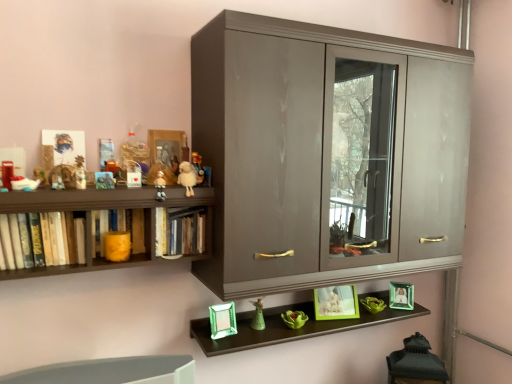
Find the location of a particular element. matte plastic toy at upper left, the 6th toy when ordered from right to left is located at coordinates (112, 168).

The image size is (512, 384). Describe the element at coordinates (112, 168) in the screenshot. I see `matte plastic toy at upper left, the second toy in the left-to-right sequence` at that location.

Looking at this image, in order to face matte plastic toy at upper center, which is the 4th toy from right to left, should I rotate leftwards or rightwards?

Rotate left and turn 12.346 degrees.

This screenshot has height=384, width=512. What do you see at coordinates (198, 167) in the screenshot?
I see `matte plastic toy at upper center, marked as the second toy in a back-to-front arrangement` at bounding box center [198, 167].

Image resolution: width=512 pixels, height=384 pixels. Identify the location of green glass photo frame at lower right, positioned as the first picture frame in right-to-left order. (401, 295).

Describe the element at coordinates (187, 177) in the screenshot. I see `fluffy white lamb at upper center, marked as the 3th toy in a right-to-left arrangement` at that location.

This screenshot has width=512, height=384. Describe the element at coordinates (166, 146) in the screenshot. I see `matte wooden picture frame at upper center, the 1th picture frame from the top` at that location.

Identify the location of matte plastic toy at upper left, arranged as the fifth toy when viewed from the front. The width and height of the screenshot is (512, 384). [112, 168].

Is matte wooden picture frame at upper center, the 1th picture frame from the top, at the right side of fluffy white lamb at upper center, which appears as the fifth toy when ordered from the bottom?

No, matte wooden picture frame at upper center, the 1th picture frame from the top, is not to the right of fluffy white lamb at upper center, which appears as the fifth toy when ordered from the bottom.

Measure the distance between matte wooden picture frame at upper center, the 3th picture frame ordered from the bottom, and fluffy white lamb at upper center, the fourth toy when ordered from front to back.

matte wooden picture frame at upper center, the 3th picture frame ordered from the bottom, and fluffy white lamb at upper center, the fourth toy when ordered from front to back, are 7.18 inches apart.

Is matte wooden picture frame at upper center, the first picture frame when ordered from left to right, further to the viewer compared to fluffy white lamb at upper center, which appears as the fifth toy when ordered from the bottom?

Result: Yes, matte wooden picture frame at upper center, the first picture frame when ordered from left to right, is further from the viewer.

Is matte wooden picture frame at upper center, the 1th picture frame from the top, next to fluffy white lamb at upper center, marked as the 3th toy in a right-to-left arrangement?

matte wooden picture frame at upper center, the 1th picture frame from the top, is not next to fluffy white lamb at upper center, marked as the 3th toy in a right-to-left arrangement, and they're not touching.

Is matte plastic toy at upper center, marked as the second toy in a back-to-front arrangement, not within matte plastic toy at upper left, arranged as the fifth toy when viewed from the front?

matte plastic toy at upper center, marked as the second toy in a back-to-front arrangement, is positioned outside matte plastic toy at upper left, arranged as the fifth toy when viewed from the front.

Is matte plastic toy at upper center, marked as the first toy in a top-to-bottom arrangement, facing towards matte plastic toy at upper left, the 6th toy when ordered from bottom to top?

No, matte plastic toy at upper center, marked as the first toy in a top-to-bottom arrangement, does not turn towards matte plastic toy at upper left, the 6th toy when ordered from bottom to top.

How distant is matte plastic toy at upper center, positioned as the 6th toy in left-to-right order, from matte plastic toy at upper left, the 6th toy when ordered from right to left?

The distance of matte plastic toy at upper center, positioned as the 6th toy in left-to-right order, from matte plastic toy at upper left, the 6th toy when ordered from right to left, is 26.35 centimeters.

Looking at this image, is matte plastic toy at upper center, placed as the 7th toy when sorted from bottom to top, smaller than matte plastic toy at upper left, arranged as the fifth toy when viewed from the front?

No.

Considering the points (202, 174) and (119, 254), which point is behind, point (202, 174) or point (119, 254)?

Positioned behind is point (202, 174).

Considering the sizes of matte plastic toy at upper center, marked as the first toy in a top-to-bottom arrangement, and orange matte candle at left, arranged as the second book when viewed from the left, in the image, is matte plastic toy at upper center, marked as the first toy in a top-to-bottom arrangement, taller or shorter than orange matte candle at left, arranged as the second book when viewed from the left,?

matte plastic toy at upper center, marked as the first toy in a top-to-bottom arrangement, is shorter than orange matte candle at left, arranged as the second book when viewed from the left.

Could you tell me if matte plastic toy at upper center, marked as the second toy in a back-to-front arrangement, is facing orange matte candle at left, arranged as the second book when viewed from the left?

No, matte plastic toy at upper center, marked as the second toy in a back-to-front arrangement, is not turned towards orange matte candle at left, arranged as the second book when viewed from the left.

Is matte plastic toy at upper center, positioned as the 6th toy in left-to-right order, thinner than orange matte candle at left, arranged as the second book when viewed from the left?

Yes.

From a real-world perspective, is green matte figurine at center, the first toy positioned from the bottom, located beneath matte plastic toy at upper left, the 6th toy when ordered from bottom to top?

Yes.

Is matte plastic toy at upper left, which is counted as the 2th toy, starting from the top, a part of green matte figurine at center, positioned as the 1th toy in right-to-left order?

No, matte plastic toy at upper left, which is counted as the 2th toy, starting from the top, is not inside green matte figurine at center, positioned as the 1th toy in right-to-left order.

Is green matte figurine at center, which appears as the 7th toy when viewed from the top, with matte plastic toy at upper left, acting as the 3th toy starting from the back?

No, green matte figurine at center, which appears as the 7th toy when viewed from the top, is not making contact with matte plastic toy at upper left, acting as the 3th toy starting from the back.

Can you confirm if green matte figurine at center, marked as the 7th toy in a left-to-right arrangement, is thinner than matte plastic toy at upper left, which is counted as the 2th toy, starting from the top?

No.

Is fluffy white lamb at upper center, marked as the third toy in a top-to-bottom arrangement, at the left side of matte brown teddy bear at upper left, acting as the 1th toy starting from the left?

Incorrect, fluffy white lamb at upper center, marked as the third toy in a top-to-bottom arrangement, is not on the left side of matte brown teddy bear at upper left, acting as the 1th toy starting from the left.

Which of these two, fluffy white lamb at upper center, marked as the third toy in a top-to-bottom arrangement, or matte brown teddy bear at upper left, which appears as the first toy when viewed from the front, stands taller?

fluffy white lamb at upper center, marked as the third toy in a top-to-bottom arrangement, is taller.

You are a GUI agent. You are given a task and a screenshot of the screen. Output one action in this format:
    pyautogui.click(x=<x>, y=<y>)
    Task: Click on the 4th toy counting from the left side of the fluffy white lamb at upper center, which appears as the fifth toy when ordered from the bottom
    This screenshot has width=512, height=384.
    Given the screenshot: What is the action you would take?
    57,182

From a real-world perspective, between fluffy white lamb at upper center, the fourth toy when ordered from front to back, and matte brown teddy bear at upper left, placed as the third toy when sorted from bottom to top, who is vertically higher?

From a 3D spatial view, fluffy white lamb at upper center, the fourth toy when ordered from front to back, is above.

This screenshot has width=512, height=384. I want to click on toy that is the 4th object located above the green matte figurine at center, positioned as the 1th toy in right-to-left order (from the image's perspective), so click(187, 177).

From a real-world perspective, is green matte figurine at center, which appears as the 7th toy when viewed from the top, located beneath fluffy white lamb at upper center, marked as the third toy in a top-to-bottom arrangement?

Yes, from a real-world perspective, green matte figurine at center, which appears as the 7th toy when viewed from the top, is beneath fluffy white lamb at upper center, marked as the third toy in a top-to-bottom arrangement.

Based on their sizes in the image, would you say green matte figurine at center, placed as the 1th toy when sorted from back to front, is bigger or smaller than fluffy white lamb at upper center, the fourth toy when ordered from front to back?

Considering their sizes, green matte figurine at center, placed as the 1th toy when sorted from back to front, takes up less space than fluffy white lamb at upper center, the fourth toy when ordered from front to back.

From the image's perspective, is green matte figurine at center, placed as the 1th toy when sorted from back to front, on fluffy white lamb at upper center, marked as the third toy in a top-to-bottom arrangement?

Incorrect, from the image's perspective, green matte figurine at center, placed as the 1th toy when sorted from back to front, is lower than fluffy white lamb at upper center, marked as the third toy in a top-to-bottom arrangement.

Is hardcover books at center, marked as the third book in a left-to-right arrangement, taller than green matte figurine at center, the seventh toy when ordered from front to back?

Correct, hardcover books at center, marked as the third book in a left-to-right arrangement, is much taller as green matte figurine at center, the seventh toy when ordered from front to back.

Is hardcover books at center, acting as the first book starting from the right, at the left side of green matte figurine at center, the first toy positioned from the bottom?

Indeed, hardcover books at center, acting as the first book starting from the right, is positioned on the left side of green matte figurine at center, the first toy positioned from the bottom.

The height and width of the screenshot is (384, 512). Identify the location of the 2nd book located above the green matte figurine at center, positioned as the 1th toy in right-to-left order (from a real-world perspective). (180, 231).

Is hardcover books at center, marked as the third book in a left-to-right arrangement, turned away from green matte figurine at center, marked as the 7th toy in a left-to-right arrangement?

No, green matte figurine at center, marked as the 7th toy in a left-to-right arrangement, is not at the back of hardcover books at center, marked as the third book in a left-to-right arrangement.

I want to click on picture frame lying above the fluffy white lamb at upper center, the fourth toy when ordered from front to back (from the image's perspective), so click(166, 146).

Which toy is the 1st one when counting from the back of the matte plastic toy at upper left, the 6th toy when ordered from bottom to top? Please provide its 2D coordinates.

[(198, 167)]

Considering their positions, is matte plastic toy at upper center, placed as the sixth toy when sorted from top to bottom, positioned closer to matte plastic toy at upper left, the second toy in the left-to-right sequence, than matte brown teddy bear at upper left, which appears as the first toy when viewed from the front?

Among the two, matte plastic toy at upper center, placed as the sixth toy when sorted from top to bottom, is located nearer to matte plastic toy at upper left, the second toy in the left-to-right sequence.

Consider the image. Which object lies further to the anchor point orange matte candle at left, marked as the second book in a right-to-left arrangement, matte wooden picture frame at upper center, the 3th picture frame ordered from the bottom, or matte plastic toy at upper center, which appears as the 2th toy when viewed from the right?

matte plastic toy at upper center, which appears as the 2th toy when viewed from the right.

From the image, which object appears to be nearer to matte brown teddy bear at upper left, placed as the third toy when sorted from bottom to top, glossy wood cupboard at center or hardcover books at left, positioned as the third book in right-to-left order?

Among the two, hardcover books at left, positioned as the third book in right-to-left order, is located nearer to matte brown teddy bear at upper left, placed as the third toy when sorted from bottom to top.

Which object lies further to the anchor point green glass photo frame at lower right, placed as the 3th picture frame when sorted from top to bottom, matte plastic toy at upper left, acting as the 3th toy starting from the back, or green matte figurine at center, the seventh toy when ordered from front to back?

Based on the image, matte plastic toy at upper left, acting as the 3th toy starting from the back, appears to be further to green glass photo frame at lower right, placed as the 3th picture frame when sorted from top to bottom.

Based on their spatial positions, is matte plastic toy at upper center, positioned as the 4th toy in left-to-right order, or matte wooden picture frame at upper center, arranged as the 1th picture frame when viewed from the front, closer to matte plastic toy at upper left, the 6th toy when ordered from right to left?

matte plastic toy at upper center, positioned as the 4th toy in left-to-right order, is closer to matte plastic toy at upper left, the 6th toy when ordered from right to left.

Estimate the real-world distances between objects in this image. Which object is closer to matte plastic toy at upper center, the 5th toy positioned from the back, fluffy white lamb at upper center, the fourth toy when ordered from front to back, or orange matte candle at left, arranged as the second book when viewed from the left?

fluffy white lamb at upper center, the fourth toy when ordered from front to back, is closer to matte plastic toy at upper center, the 5th toy positioned from the back.

Estimate the real-world distances between objects in this image. Which object is closer to matte brown teddy bear at upper left, acting as the 1th toy starting from the left, matte plastic toy at upper left, marked as the sixth toy in a back-to-front arrangement, or green glass photo frame at lower right, which is the third picture frame in left-to-right order?

matte plastic toy at upper left, marked as the sixth toy in a back-to-front arrangement, is positioned closer to the anchor matte brown teddy bear at upper left, acting as the 1th toy starting from the left.

When comparing their distances from hardcover books at center, marked as the third book in a left-to-right arrangement, does orange matte candle at left, marked as the second book in a right-to-left arrangement, or matte plastic toy at upper center, placed as the sixth toy when sorted from top to bottom, seem closer?

Based on the image, orange matte candle at left, marked as the second book in a right-to-left arrangement, appears to be nearer to hardcover books at center, marked as the third book in a left-to-right arrangement.

Identify the location of cupboard between fluffy white lamb at upper center, which is the 4th toy from back to front, and green glass photo frame at lower right, placed as the first picture frame when sorted from bottom to top, from left to right. (321, 152).

Where is `toy between matte plastic toy at upper left, the second toy from the front, and hardcover books at center, marked as the third book in a left-to-right arrangement`? This screenshot has height=384, width=512. toy between matte plastic toy at upper left, the second toy from the front, and hardcover books at center, marked as the third book in a left-to-right arrangement is located at coordinates (160, 186).

Where is `picture frame located between matte plastic toy at upper left, acting as the 3th toy starting from the back, and matte plastic toy at upper center, placed as the 7th toy when sorted from bottom to top, in the left-right direction`? This screenshot has width=512, height=384. picture frame located between matte plastic toy at upper left, acting as the 3th toy starting from the back, and matte plastic toy at upper center, placed as the 7th toy when sorted from bottom to top, in the left-right direction is located at coordinates (166, 146).

Locate an element on the screen. book between hardcover books at left, marked as the 1th book in a left-to-right arrangement, and hardcover books at center, acting as the first book starting from the right is located at coordinates (118, 232).